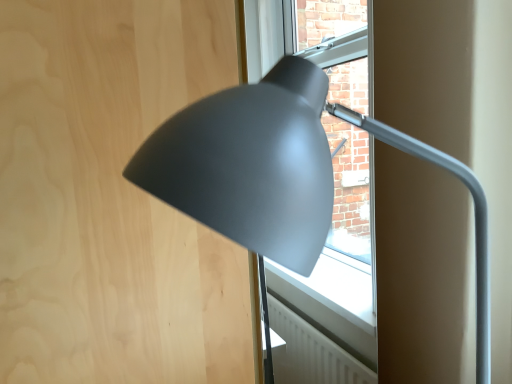
Question: Is matte gray lamp at center wider than matte wood plywood at upper left?

Choices:
 (A) yes
 (B) no

Answer: (B)

Question: Is matte gray lamp at center shorter than matte wood plywood at upper left?

Choices:
 (A) no
 (B) yes

Answer: (B)

Question: Would you consider matte gray lamp at center to be distant from matte wood plywood at upper left?

Choices:
 (A) yes
 (B) no

Answer: (B)

Question: Can you confirm if matte gray lamp at center is taller than matte wood plywood at upper left?

Choices:
 (A) no
 (B) yes

Answer: (A)

Question: Is matte gray lamp at center positioned behind matte wood plywood at upper left?

Choices:
 (A) yes
 (B) no

Answer: (B)

Question: Could you tell me if matte gray lamp at center is facing matte wood plywood at upper left?

Choices:
 (A) no
 (B) yes

Answer: (A)

Question: Is matte wood plywood at upper left oriented towards matte gray lamp at center?

Choices:
 (A) no
 (B) yes

Answer: (B)

Question: Does matte wood plywood at upper left lie behind matte gray lamp at center?

Choices:
 (A) no
 (B) yes

Answer: (B)

Question: From the image's perspective, does matte wood plywood at upper left appear higher than matte gray lamp at center?

Choices:
 (A) yes
 (B) no

Answer: (B)

Question: From the image's perspective, is matte wood plywood at upper left located beneath matte gray lamp at center?

Choices:
 (A) no
 (B) yes

Answer: (B)

Question: Considering the relative sizes of matte wood plywood at upper left and matte gray lamp at center in the image provided, is matte wood plywood at upper left shorter than matte gray lamp at center?

Choices:
 (A) yes
 (B) no

Answer: (B)

Question: Is matte wood plywood at upper left positioned far away from matte gray lamp at center?

Choices:
 (A) yes
 (B) no

Answer: (B)

Question: From the image's perspective, is matte wood plywood at upper left located above or below matte gray lamp at center?

Choices:
 (A) below
 (B) above

Answer: (A)